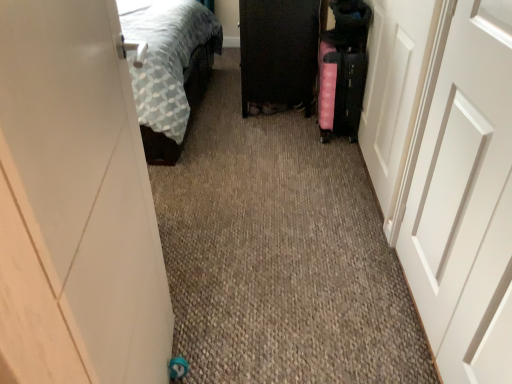
Question: Should I look upward or downward to see white matte door at right, placed as the 2th door when sorted from left to right?

Choices:
 (A) up
 (B) down

Answer: (B)

Question: Is pink fabric suitcase at right next to white matte door at right, placed as the 2th door when sorted from left to right?

Choices:
 (A) yes
 (B) no

Answer: (B)

Question: Is pink fabric suitcase at right turned away from white matte door at right, arranged as the 2th door when viewed from the right?

Choices:
 (A) yes
 (B) no

Answer: (B)

Question: From a real-world perspective, is pink fabric suitcase at right over white matte door at right, arranged as the 2th door when viewed from the right?

Choices:
 (A) yes
 (B) no

Answer: (B)

Question: Would you consider pink fabric suitcase at right to be distant from white matte door at right, arranged as the 2th door when viewed from the right?

Choices:
 (A) no
 (B) yes

Answer: (B)

Question: Is pink fabric suitcase at right bigger than white matte door at right, placed as the 2th door when sorted from left to right?

Choices:
 (A) no
 (B) yes

Answer: (B)

Question: Can you confirm if pink fabric suitcase at right is taller than white matte door at right, placed as the 2th door when sorted from left to right?

Choices:
 (A) yes
 (B) no

Answer: (B)

Question: Is black glossy cabinet at center bigger than pink fabric suitcase at right?

Choices:
 (A) yes
 (B) no

Answer: (A)

Question: Is pink fabric suitcase at right at the back of black glossy cabinet at center?

Choices:
 (A) no
 (B) yes

Answer: (A)

Question: Considering the relative sizes of black glossy cabinet at center and pink fabric suitcase at right in the image provided, is black glossy cabinet at center shorter than pink fabric suitcase at right?

Choices:
 (A) yes
 (B) no

Answer: (B)

Question: Does black glossy cabinet at center lie in front of pink fabric suitcase at right?

Choices:
 (A) no
 (B) yes

Answer: (A)

Question: Is black glossy cabinet at center placed right next to pink fabric suitcase at right?

Choices:
 (A) yes
 (B) no

Answer: (B)

Question: Is black glossy cabinet at center facing towards pink fabric suitcase at right?

Choices:
 (A) no
 (B) yes

Answer: (A)

Question: Considering the relative sizes of pink fabric suitcase at right and black glossy cabinet at center in the image provided, is pink fabric suitcase at right shorter than black glossy cabinet at center?

Choices:
 (A) no
 (B) yes

Answer: (B)